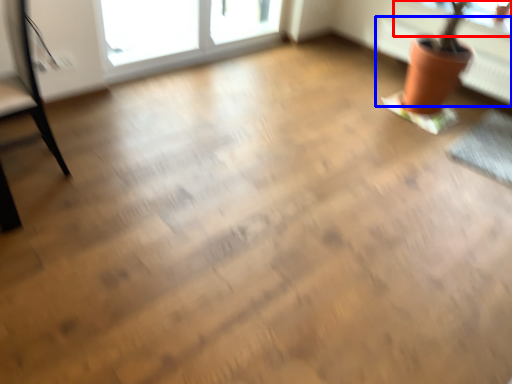
Question: Which object is closer to the camera taking this photo, window screen (highlighted by a red box) or radiator (highlighted by a blue box)?

Choices:
 (A) window screen
 (B) radiator

Answer: (B)